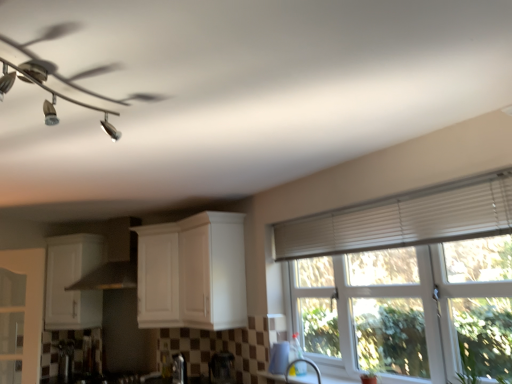
Question: Is point (231, 377) closer or farther from the camera than point (4, 66)?

Choices:
 (A) farther
 (B) closer

Answer: (A)

Question: Is metallic silver kettle at lower center, the 2th appliance positioned from the front, wider or thinner than metallic silver ceiling fan at upper left?

Choices:
 (A) wide
 (B) thin

Answer: (B)

Question: Which object is the farthest from the satin nickel faucet at lower center?

Choices:
 (A) satin silver kettle at lower left, which is the fifth appliance in right-to-left order
 (B) white textured window at upper right
 (C) metallic silver ceiling fan at upper left
 (D) metallic stainless steel kettle at lower left, which is the second appliance in left-to-right order
 (E) satin silver toaster at lower center, which ranks as the 3th appliance in front-to-back order

Answer: (A)

Question: Estimate the real-world distances between objects in this image. Which object is farther from the metallic silver ceiling fan at upper left?

Choices:
 (A) metallic stainless steel kettle at lower left, the fourth appliance in the front-to-back sequence
 (B) white textured window at upper right
 (C) satin silver kettle at lower left, positioned as the 1th appliance in left-to-right order
 (D) satin nickel faucet at lower center
 (E) white matte cabinet at lower left, marked as the second cabinetry in a right-to-left arrangement

Answer: (C)